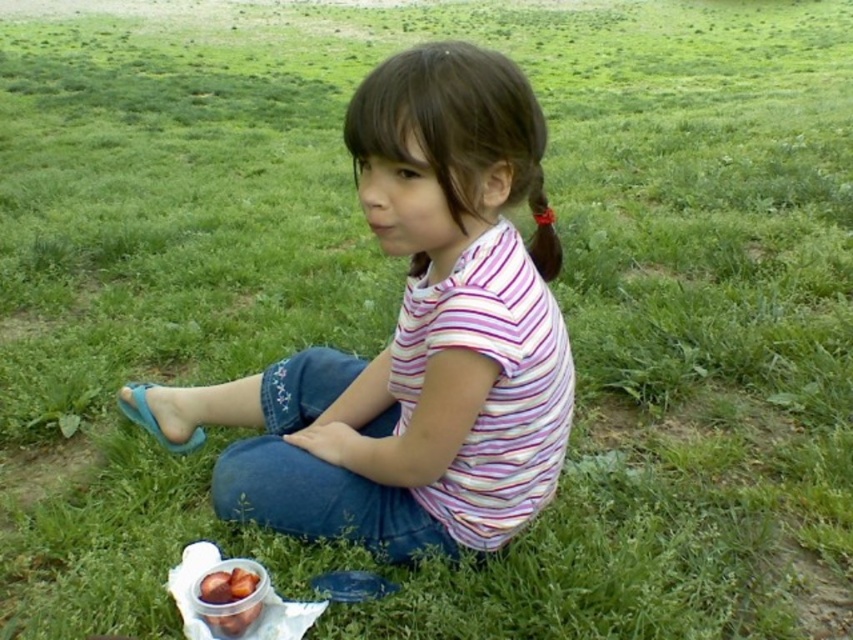
Question: Does striped cotton shirt at center appear on the right side of shiny plastic container of nuts at lower left?

Choices:
 (A) no
 (B) yes

Answer: (B)

Question: Is striped cotton shirt at center thinner than shiny plastic container of nuts at lower left?

Choices:
 (A) no
 (B) yes

Answer: (A)

Question: Which point is farther to the camera?

Choices:
 (A) striped cotton shirt at center
 (B) shiny plastic container of nuts at lower left

Answer: (B)

Question: Among these objects, which one is farthest from the camera?

Choices:
 (A) shiny plastic container of nuts at lower left
 (B) striped cotton shirt at center

Answer: (A)

Question: Can you confirm if striped cotton shirt at center is bigger than shiny plastic container of nuts at lower left?

Choices:
 (A) yes
 (B) no

Answer: (A)